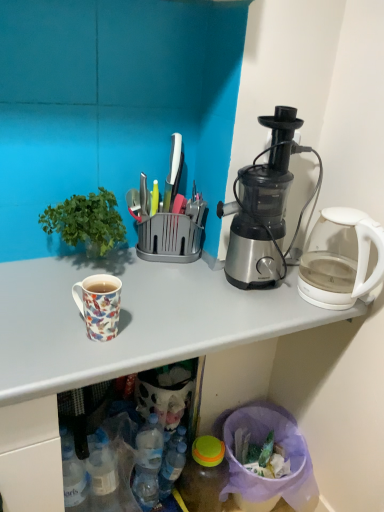
Question: Is translucent plastic bottle at lower center, acting as the second bottle starting from the right, positioned behind green leafy plant at left?

Choices:
 (A) yes
 (B) no

Answer: (A)

Question: Is translucent plastic bottle at lower center, acting as the second bottle starting from the right, far from green leafy plant at left?

Choices:
 (A) no
 (B) yes

Answer: (A)

Question: Can you confirm if translucent plastic bottle at lower center, the first bottle positioned from the left, is thinner than green leafy plant at left?

Choices:
 (A) no
 (B) yes

Answer: (B)

Question: Considering the relative sizes of translucent plastic bottle at lower center, acting as the second bottle starting from the right, and green leafy plant at left in the image provided, is translucent plastic bottle at lower center, acting as the second bottle starting from the right, taller than green leafy plant at left?

Choices:
 (A) no
 (B) yes

Answer: (A)

Question: From a real-world perspective, is translucent plastic bottle at lower center, acting as the second bottle starting from the right, positioned over green leafy plant at left based on gravity?

Choices:
 (A) no
 (B) yes

Answer: (A)

Question: From the image's perspective, is transparent glass kettle at right positioned above or below translucent plastic bottle at lower center, acting as the second bottle starting from the right?

Choices:
 (A) below
 (B) above

Answer: (B)

Question: Visually, is transparent glass kettle at right positioned to the left or to the right of translucent plastic bottle at lower center, acting as the second bottle starting from the right?

Choices:
 (A) right
 (B) left

Answer: (A)

Question: Is transparent glass kettle at right taller or shorter than translucent plastic bottle at lower center, the first bottle positioned from the left?

Choices:
 (A) tall
 (B) short

Answer: (A)

Question: Considering their positions, is transparent glass kettle at right located in front of or behind translucent plastic bottle at lower center, acting as the second bottle starting from the right?

Choices:
 (A) front
 (B) behind

Answer: (A)

Question: Considering the relative positions of translucent plastic bottle at lower center, which is the 2th bottle in left-to-right order, and transparent glass kettle at right in the image provided, is translucent plastic bottle at lower center, which is the 2th bottle in left-to-right order, to the left or to the right of transparent glass kettle at right?

Choices:
 (A) right
 (B) left

Answer: (B)

Question: Looking at the image, does translucent plastic bottle at lower center, the first bottle in the right-to-left sequence, seem bigger or smaller compared to transparent glass kettle at right?

Choices:
 (A) big
 (B) small

Answer: (B)

Question: Considering their positions, is translucent plastic bottle at lower center, which is the 2th bottle in left-to-right order, located in front of or behind transparent glass kettle at right?

Choices:
 (A) behind
 (B) front

Answer: (A)

Question: From the image's perspective, is translucent plastic bottle at lower center, which is the 2th bottle in left-to-right order, above or below transparent glass kettle at right?

Choices:
 (A) below
 (B) above

Answer: (A)

Question: Is satin silver blender at right wider or thinner than translucent plastic bottle at lower center, acting as the second bottle starting from the right?

Choices:
 (A) wide
 (B) thin

Answer: (A)

Question: In the image, is satin silver blender at right positioned in front of or behind translucent plastic bottle at lower center, acting as the second bottle starting from the right?

Choices:
 (A) behind
 (B) front

Answer: (B)